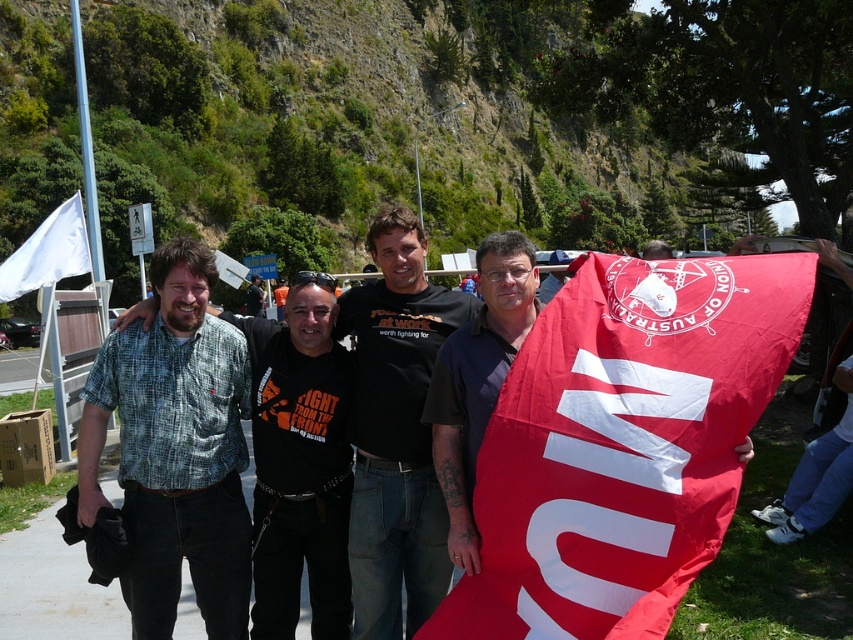
Question: Can you confirm if red fabric flag at right is smaller than dark blue shirt at center?

Choices:
 (A) yes
 (B) no

Answer: (B)

Question: Can you confirm if black cotton t-shirt at center is smaller than dark blue shirt at center?

Choices:
 (A) yes
 (B) no

Answer: (B)

Question: Does black cotton t-shirt at center have a smaller size compared to black t-shirt at center?

Choices:
 (A) no
 (B) yes

Answer: (B)

Question: Which object is positioned closest to the dark blue shirt at center?

Choices:
 (A) green plaid shirt at left
 (B) black t-shirt at center
 (C) red fabric flag at right

Answer: (C)

Question: Based on their relative distances, which object is nearer to the green plaid shirt at left?

Choices:
 (A) dark blue shirt at center
 (B) red fabric flag at right
 (C) black cotton t-shirt at center
 (D) black t-shirt at center

Answer: (C)

Question: Among these objects, which one is nearest to the camera?

Choices:
 (A) black cotton t-shirt at center
 (B) red fabric flag at right
 (C) black t-shirt at center

Answer: (B)